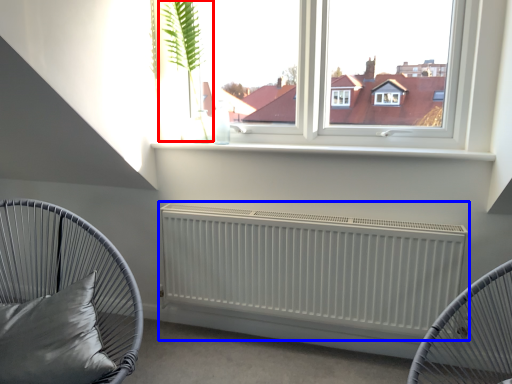
Question: Which point is closer to the camera, plant (highlighted by a red box) or radiator (highlighted by a blue box)?

Choices:
 (A) plant
 (B) radiator

Answer: (B)